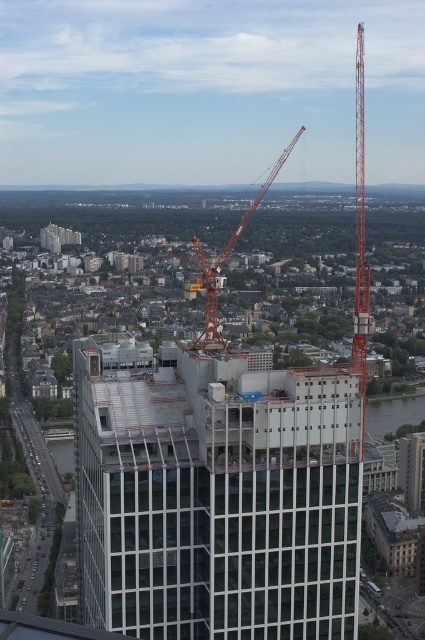
Question: Can you confirm if clear glass building at center is positioned below orange metallic crane at center?

Choices:
 (A) yes
 (B) no

Answer: (A)

Question: Can you confirm if clear glass building at center is positioned to the right of orange metallic crane at center?

Choices:
 (A) yes
 (B) no

Answer: (B)

Question: Does clear glass building at center appear under orange metallic crane at center?

Choices:
 (A) yes
 (B) no

Answer: (A)